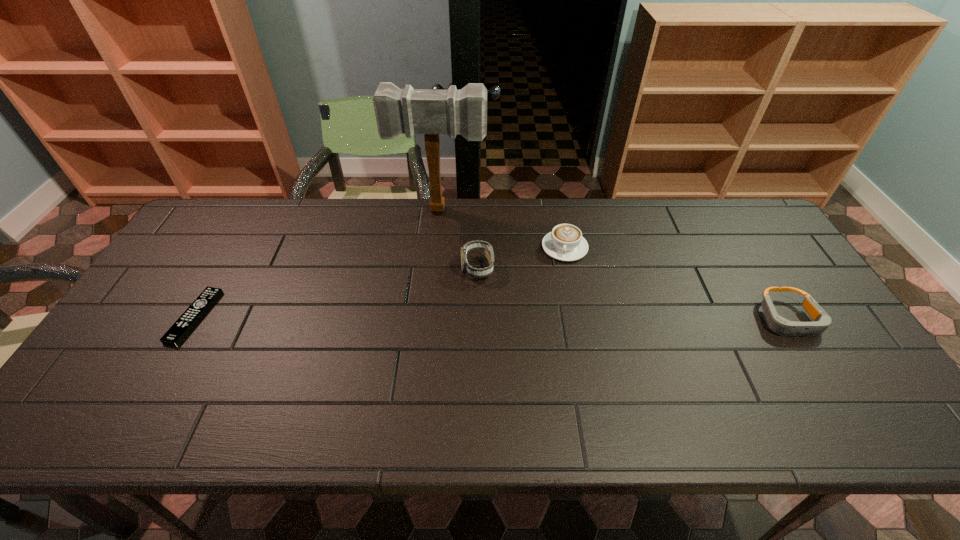
At what (x,y) coordinates should I click in order to perform the action: click on vacant region located on the front and back of the second shortest object. Please return your answer as a coordinate pair (x, y). This screenshot has height=540, width=960. Looking at the image, I should click on (819, 369).

The image size is (960, 540). In order to click on free space located at the head of the tallest object in this screenshot , I will do `click(429, 273)`.

Where is `vacant region located 0.140m at the head of the tallest object`? The image size is (960, 540). vacant region located 0.140m at the head of the tallest object is located at coordinates (433, 247).

I want to click on blank area located at the head of the tallest object, so click(431, 261).

The image size is (960, 540). What are the coordinates of `vacant space located 0.120m on the face of the watch` in the screenshot? It's located at (444, 307).

Where is `blank space located 0.150m on the face of the watch`? blank space located 0.150m on the face of the watch is located at coordinates (438, 315).

I want to click on vacant region located on the face of the watch, so click(450, 300).

Identify the location of vacant area situated 0.240m with the handle on the right side of the third shortest object. Image resolution: width=960 pixels, height=540 pixels. (565, 327).

Identify the location of vacant space situated 0.070m with the handle on the right side of the third shortest object. click(x=565, y=280).

Locate an element on the screen. free location located with the handle on the right side of the third shortest object is located at coordinates (565, 336).